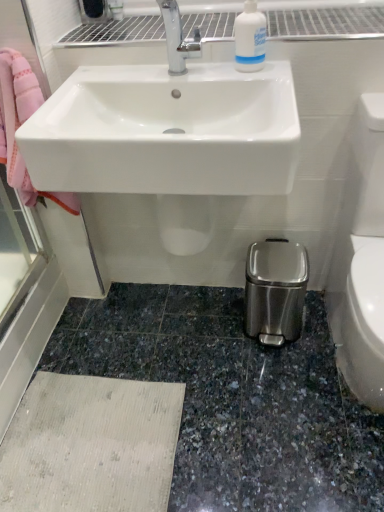
Question: Is white glossy sink at upper center taller than white glossy toilet bowl at lower right?

Choices:
 (A) yes
 (B) no

Answer: (B)

Question: Are white glossy sink at upper center and white glossy toilet bowl at lower right located far from each other?

Choices:
 (A) yes
 (B) no

Answer: (B)

Question: From the image's perspective, does white glossy sink at upper center appear higher than white glossy toilet bowl at lower right?

Choices:
 (A) yes
 (B) no

Answer: (A)

Question: Is white glossy sink at upper center further to camera compared to white glossy toilet bowl at lower right?

Choices:
 (A) yes
 (B) no

Answer: (A)

Question: From the image's perspective, is white glossy sink at upper center located beneath white glossy toilet bowl at lower right?

Choices:
 (A) yes
 (B) no

Answer: (B)

Question: Considering the relative sizes of white glossy sink at upper center and white glossy toilet bowl at lower right in the image provided, is white glossy sink at upper center smaller than white glossy toilet bowl at lower right?

Choices:
 (A) yes
 (B) no

Answer: (B)

Question: From a real-world perspective, is white glossy sink at upper center over white plastic bottle at upper center?

Choices:
 (A) no
 (B) yes

Answer: (A)

Question: Could you tell me if white glossy sink at upper center is turned towards white plastic bottle at upper center?

Choices:
 (A) no
 (B) yes

Answer: (A)

Question: From a real-world perspective, is white glossy sink at upper center physically below white plastic bottle at upper center?

Choices:
 (A) no
 (B) yes

Answer: (B)

Question: Is white glossy sink at upper center further to the viewer compared to white plastic bottle at upper center?

Choices:
 (A) yes
 (B) no

Answer: (B)

Question: Can you confirm if white glossy sink at upper center is thinner than white plastic bottle at upper center?

Choices:
 (A) no
 (B) yes

Answer: (A)

Question: From the image's perspective, is white glossy sink at upper center beneath white plastic bottle at upper center?

Choices:
 (A) no
 (B) yes

Answer: (B)

Question: Considering the relative sizes of white glossy toilet bowl at lower right and white plastic bottle at upper center in the image provided, is white glossy toilet bowl at lower right bigger than white plastic bottle at upper center?

Choices:
 (A) no
 (B) yes

Answer: (B)